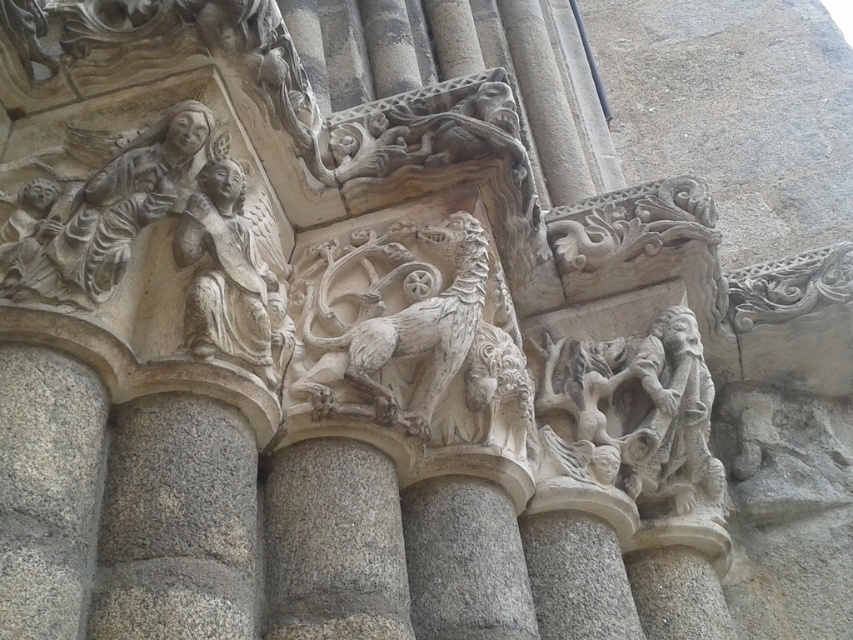
You are an art conservator examining the gray stone pillar at center and the gray stone relief at upper left. Which object would require more material for restoration due to its size?

The gray stone pillar at center is larger in size than the gray stone relief at upper left, so it would require more material for restoration due to its size.

You are an art conservator examining the stone carvings. You need to clean the carved stone figure at center and the gray stone relief at upper left. Which object should you clean first if you want to start from the lower part of the structure?

The carved stone figure at center should be cleaned first because it is located below the gray stone relief at upper left, making it the lower part of the structure.